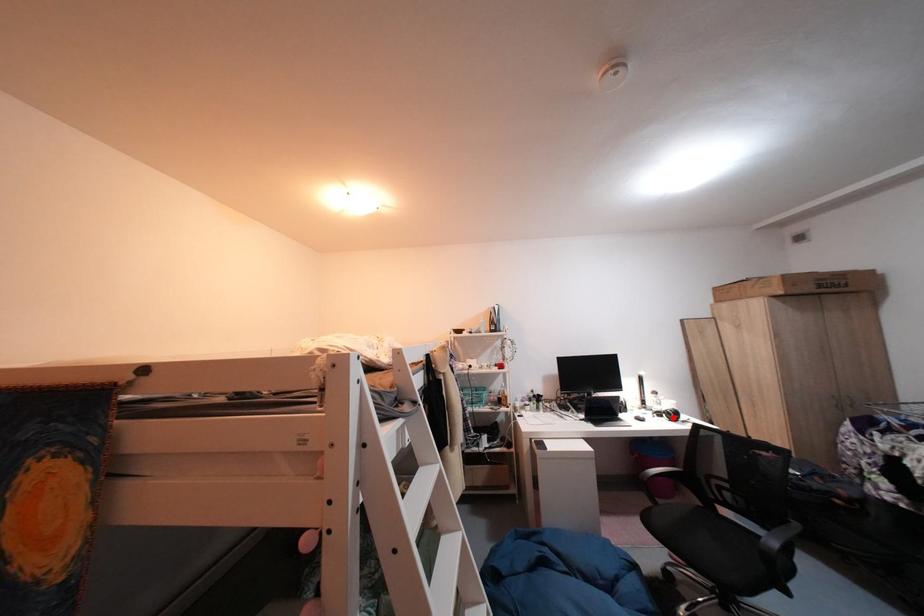
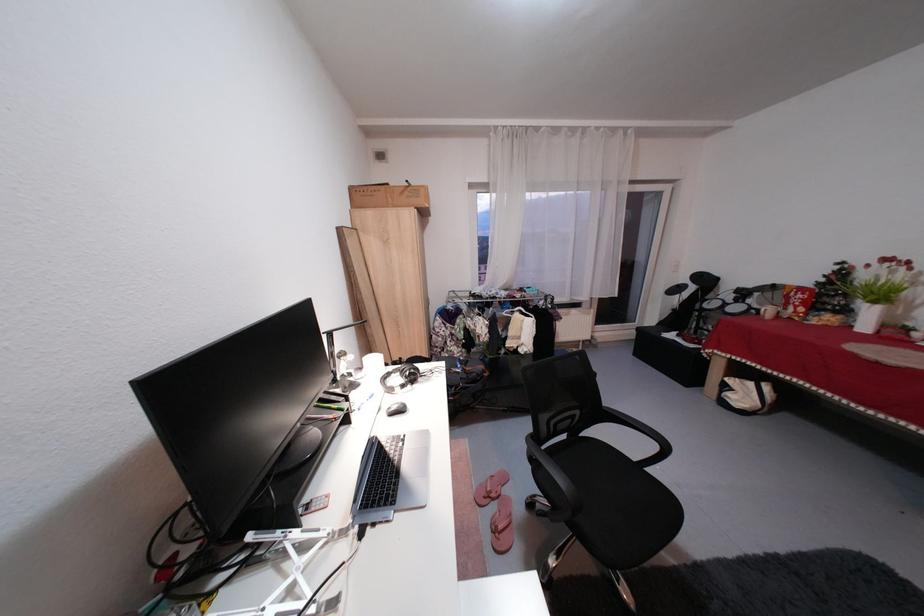
Question: I am providing you with two images of the same scene from different viewpoints. A red point is marked on the first image. Is the red point's position out of view in image 2?

Choices:
 (A) Yes
 (B) No

Answer: (A)